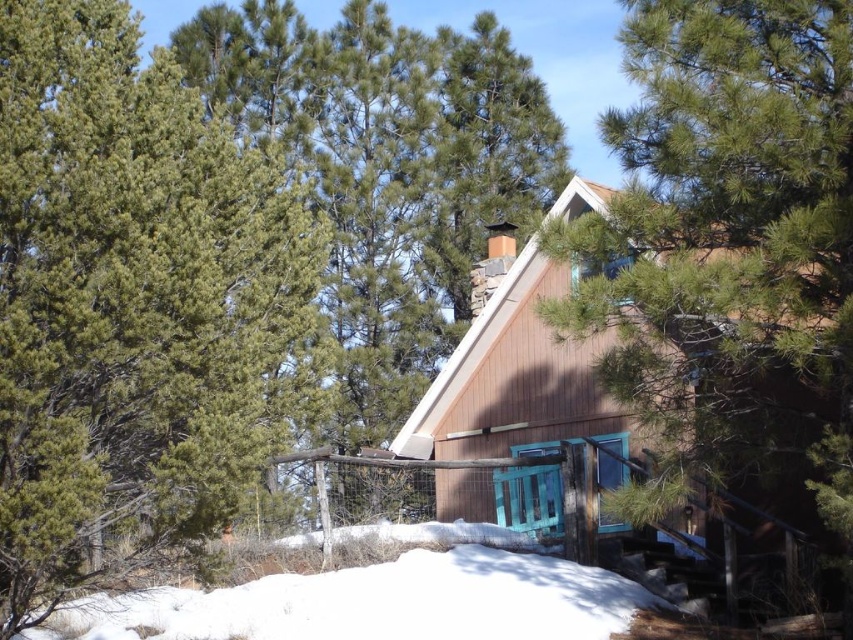
Question: Is the position of white powdery snow at lower center less distant than that of wooden cabin at center?

Choices:
 (A) yes
 (B) no

Answer: (A)

Question: Is green needle-like at upper left smaller than green pine tree at center?

Choices:
 (A) yes
 (B) no

Answer: (B)

Question: Which of the following is the farthest from the observer?

Choices:
 (A) green pine tree at center
 (B) wooden cabin at center
 (C) white powdery snow at lower center

Answer: (B)

Question: Which object is the closest to the white powdery snow at lower center?

Choices:
 (A) green pine tree at center
 (B) green needle-like at upper left

Answer: (B)

Question: Does white powdery snow at lower center have a greater width compared to wooden cabin at center?

Choices:
 (A) no
 (B) yes

Answer: (B)

Question: Which object appears farthest from the camera in this image?

Choices:
 (A) white powdery snow at lower center
 (B) green pine tree at center
 (C) green needle-like at upper left
 (D) wooden cabin at center

Answer: (D)